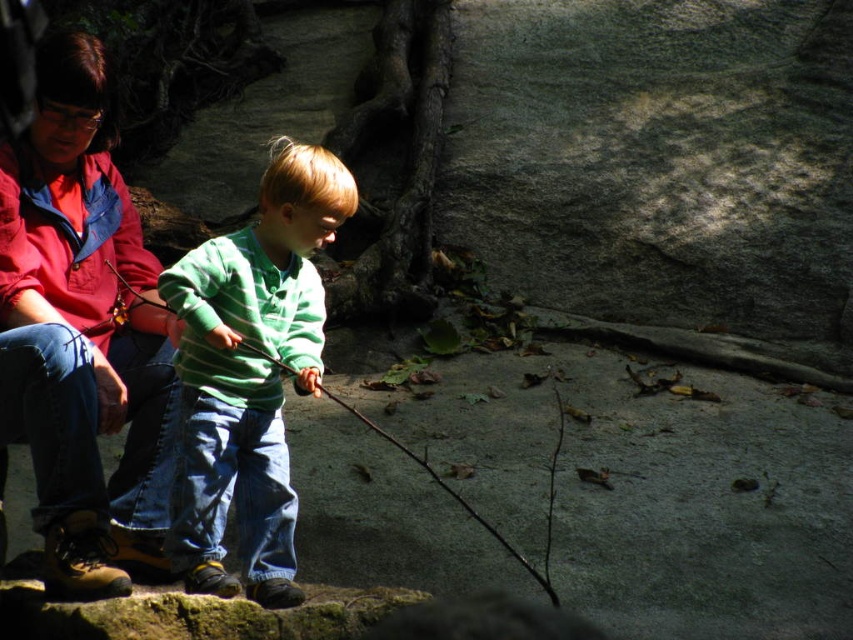
From the picture: You are a photographer trying to capture both the red cotton shirt at upper left and the green striped sweater at center in a single frame. Considering their heights, which one should you focus on to ensure both are visible without cropping?

The red cotton shirt at upper left is much taller than the green striped sweater at center. To ensure both are visible without cropping, focus on the red cotton shirt at upper left as the primary subject, adjusting the camera angle to include the shorter green striped sweater at center in the frame.

You are a hiker who needs to place a small item on the ground near the green striped sweater at center and the wooden stick at center. Which object should you place the item closer to if you want it to be on the ground level?

The wooden stick at center is on the ground level because the green striped sweater at center is above it.

You are standing in the park and see two points on the ground. The first point is at coordinates point (x=283, y=579) and the second point is at point (x=285, y=365). Which point is closer to you?

Point (x=283, y=579) is further to the camera than point (x=285, y=365), so the second point is closer to you.